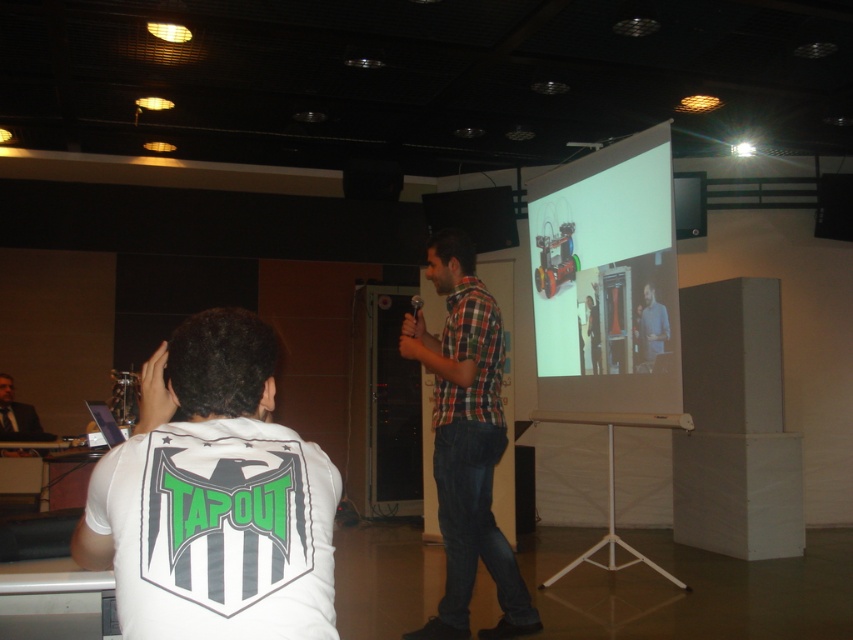
Question: Observing the image, what is the correct spatial positioning of white matte shirt at lower left in reference to white matte projection screen at upper right?

Choices:
 (A) right
 (B) left

Answer: (B)

Question: Does white matte projection screen at upper right appear on the right side of matte blue shirt at center?

Choices:
 (A) no
 (B) yes

Answer: (A)

Question: Which of the following is the farthest from the observer?

Choices:
 (A) (28, 426)
 (B) (663, 348)
 (C) (158, 422)
 (D) (463, 570)

Answer: (A)

Question: Can you confirm if white matte shirt at lower left is wider than black suit at left?

Choices:
 (A) no
 (B) yes

Answer: (A)

Question: Which point is farther from the camera taking this photo?

Choices:
 (A) (645, 355)
 (B) (602, 330)
 (C) (277, 525)
 (D) (9, 420)

Answer: (D)

Question: Among these objects, which one is nearest to the camera?

Choices:
 (A) white matte shirt at lower left
 (B) checkered fabric shirt at center
 (C) black suit at left
 (D) white matte projection screen at upper right

Answer: (A)